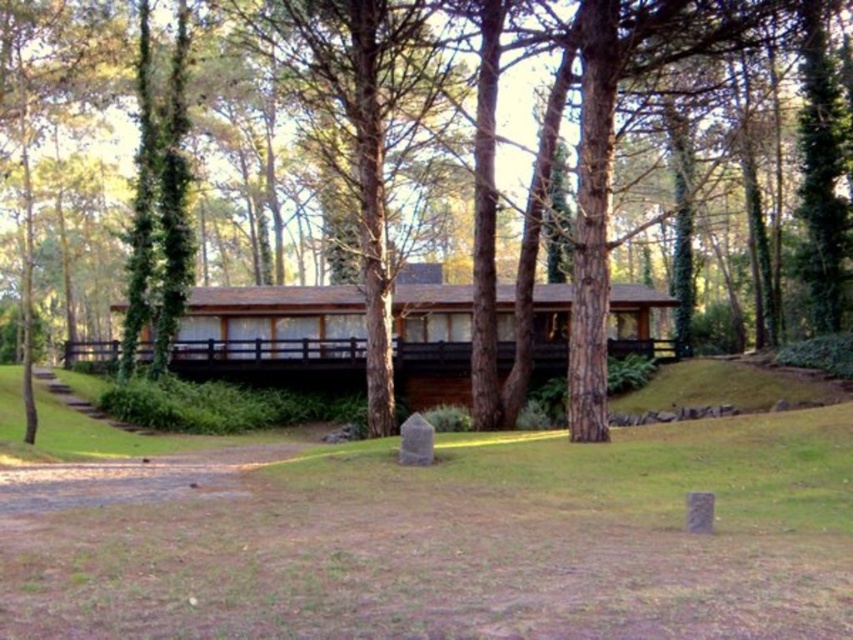
Question: Can you confirm if green grass at center is wider than brown wood tree at center?

Choices:
 (A) no
 (B) yes

Answer: (A)

Question: Which point is farther from the camera taking this photo?

Choices:
 (A) (816, 614)
 (B) (720, 48)

Answer: (B)

Question: Which of the following is the closest to the observer?

Choices:
 (A) (640, 289)
 (B) (724, 572)

Answer: (B)

Question: Can you confirm if green grass at center is bigger than brown wood tree at center?

Choices:
 (A) no
 (B) yes

Answer: (A)

Question: Which point is farther to the camera?

Choices:
 (A) (502, 449)
 (B) (589, 371)

Answer: (B)

Question: Can you confirm if green grass at center is bigger than brown wood tree at center?

Choices:
 (A) yes
 (B) no

Answer: (B)